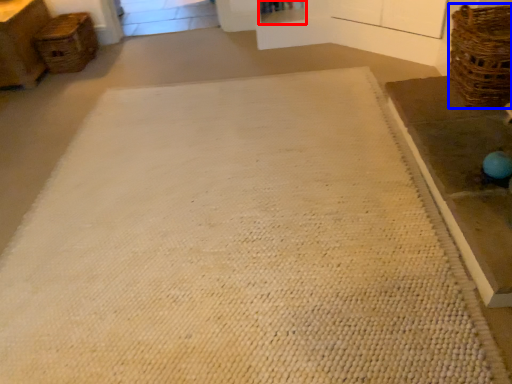
Question: Which object appears closest to the camera in this image, shelf (highlighted by a red box) or basket (highlighted by a blue box)?

Choices:
 (A) shelf
 (B) basket

Answer: (B)